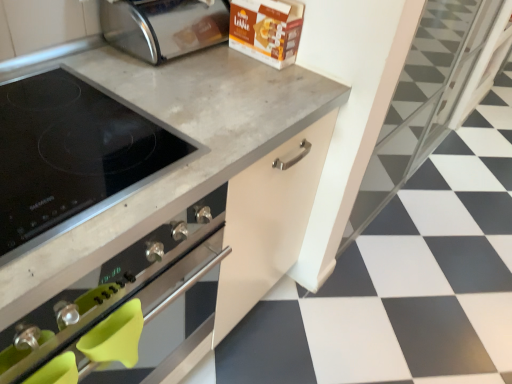
Question: In which direction should I rotate to look at polished stainless steel toaster at upper center?

Choices:
 (A) left
 (B) right

Answer: (A)

Question: Is polished stainless steel toaster at upper center outside of black matte stovetop at center?

Choices:
 (A) no
 (B) yes

Answer: (B)

Question: From the image's perspective, is polished stainless steel toaster at upper center under black matte stovetop at center?

Choices:
 (A) yes
 (B) no

Answer: (B)

Question: Is polished stainless steel toaster at upper center aimed at black matte stovetop at center?

Choices:
 (A) yes
 (B) no

Answer: (B)

Question: Does polished stainless steel toaster at upper center lie in front of black matte stovetop at center?

Choices:
 (A) yes
 (B) no

Answer: (B)

Question: Can you confirm if polished stainless steel toaster at upper center is shorter than black matte stovetop at center?

Choices:
 (A) yes
 (B) no

Answer: (A)

Question: From a real-world perspective, does polished stainless steel toaster at upper center sit lower than black matte stovetop at center?

Choices:
 (A) yes
 (B) no

Answer: (B)

Question: Considering the relative sizes of polished stainless steel toaster at upper center and white glossy tile at center in the image provided, is polished stainless steel toaster at upper center taller than white glossy tile at center?

Choices:
 (A) no
 (B) yes

Answer: (B)

Question: Is polished stainless steel toaster at upper center positioned in front of white glossy tile at center?

Choices:
 (A) no
 (B) yes

Answer: (A)

Question: Can white glossy tile at center be found inside polished stainless steel toaster at upper center?

Choices:
 (A) yes
 (B) no

Answer: (B)

Question: Does polished stainless steel toaster at upper center turn towards white glossy tile at center?

Choices:
 (A) no
 (B) yes

Answer: (A)

Question: Does polished stainless steel toaster at upper center have a larger size compared to white glossy tile at center?

Choices:
 (A) no
 (B) yes

Answer: (A)

Question: Is polished stainless steel toaster at upper center not within white glossy tile at center?

Choices:
 (A) no
 (B) yes

Answer: (B)

Question: Considering the relative sizes of black glass cooktop at upper left and black matte stovetop at center in the image provided, is black glass cooktop at upper left taller than black matte stovetop at center?

Choices:
 (A) yes
 (B) no

Answer: (B)